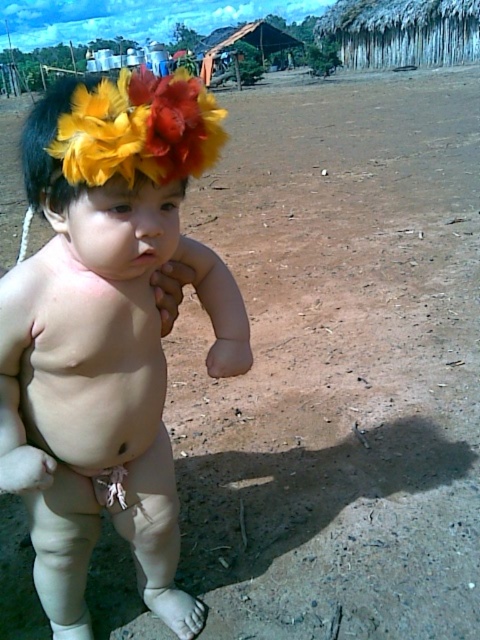
The child is playing in the dirt. You need to determine if the pink smooth skin at center is taller than the white cloth diaper at lower center. Can you confirm this?

The pink smooth skin at center has a greater height compared to the white cloth diaper at lower center, so yes, the pink smooth skin at center is taller than the white cloth diaper at lower center.

You are a drone operator trying to capture aerial footage of the child in the scene. You have two points marked on your map for drone landing spots. The first point is at coordinate point[56,426] and the second at point[106,131]. From the child standing position, which landing spot is closer to the child?

Point[106,131] is closer to the child because it is in front of point[56,426], which is behind it.

You are a photographer trying to capture the child in the scene. You need to focus on the pink smooth skin at center. Where exactly should you aim your camera to ensure the focus is on this area?

The pink smooth skin at center is located at point coordinates 0.570 on the x axis and 0.188 on the y axis, so you should aim your camera at those coordinates to focus on it.